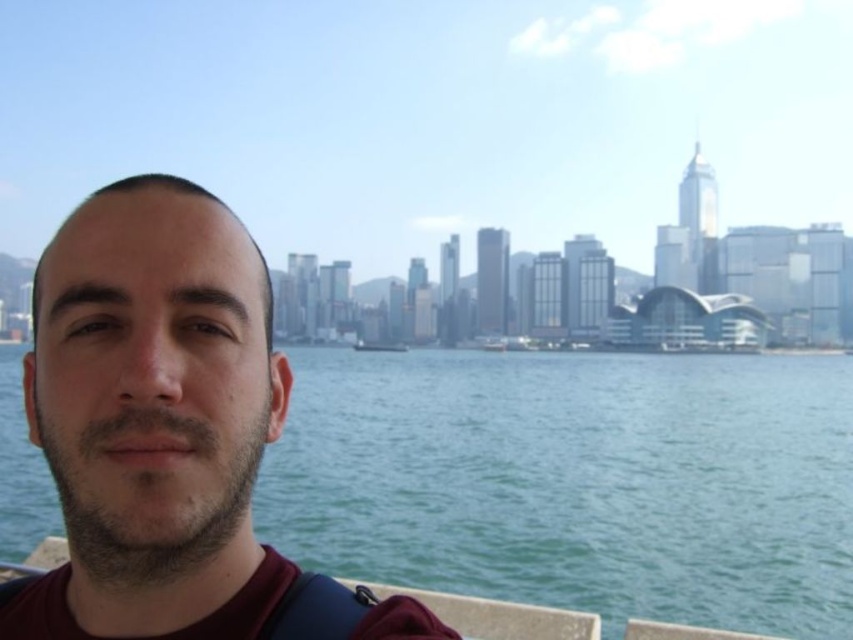
Between green water at center and matte black face at left, which one is positioned lower?

Positioned lower is green water at center.

Which is more to the left, green water at center or matte black face at left?

Positioned to the left is matte black face at left.

Is point (682, 371) closer to viewer compared to point (62, 257)?

No.

Identify the location of green water at center. Image resolution: width=853 pixels, height=640 pixels. (576, 481).

Does matte black face at left appear on the left side of wooden sailboat at center?

Correct, you'll find matte black face at left to the left of wooden sailboat at center.

How much distance is there between matte black face at left and wooden sailboat at center?

matte black face at left is 250.21 meters from wooden sailboat at center.

This screenshot has width=853, height=640. Identify the location of matte black face at left. (154, 419).

The width and height of the screenshot is (853, 640). In order to click on green water at center in this screenshot , I will do `click(576, 481)`.